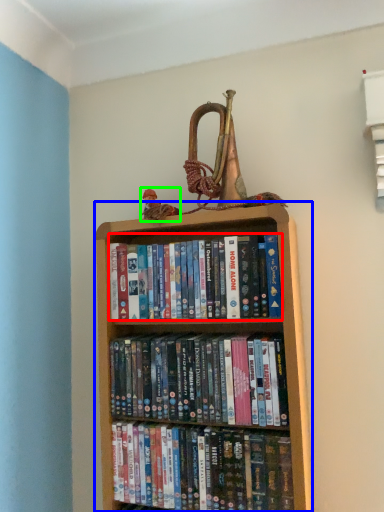
Question: Estimate the real-world distances between objects in this image. Which object is closer to book (highlighted by a red box), bookcase (highlighted by a blue box) or toy (highlighted by a green box)?

Choices:
 (A) bookcase
 (B) toy

Answer: (A)